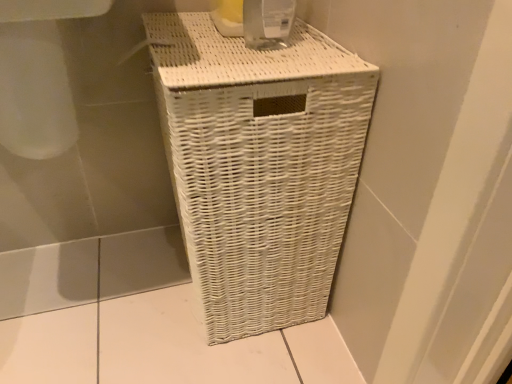
Describe the element at coordinates (260, 166) in the screenshot. The width and height of the screenshot is (512, 384). I see `white wicker laundry basket at center` at that location.

Where is `white wicker laundry basket at center`? This screenshot has height=384, width=512. white wicker laundry basket at center is located at coordinates click(x=260, y=166).

What are the coordinates of `white wicker laundry basket at center` in the screenshot? It's located at (260, 166).